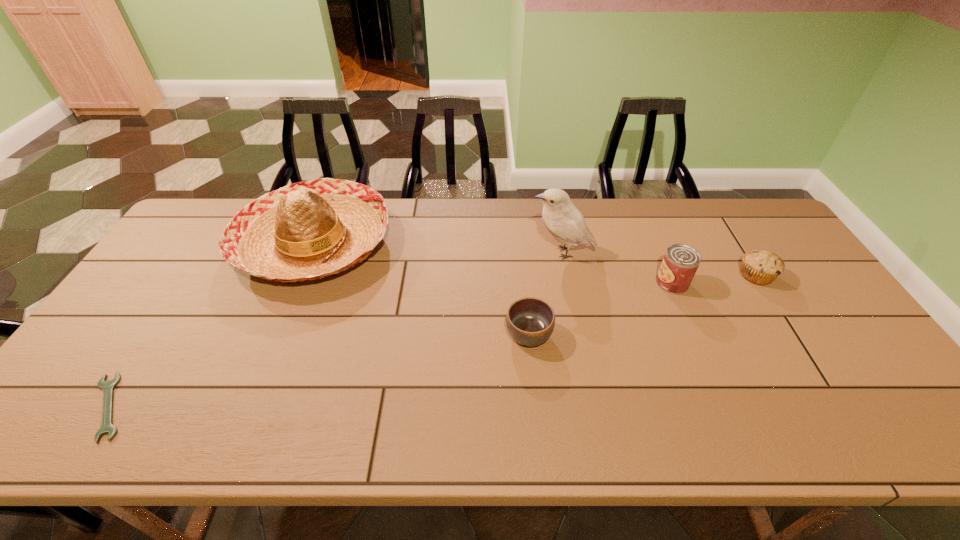
Find the location of `vacant area that lies between the fifth object from left to right and the rightmost object`. vacant area that lies between the fifth object from left to right and the rightmost object is located at coordinates (714, 279).

I want to click on vacant space in between the second nearest object and the muffin, so click(x=642, y=305).

Find the location of a particular element. The width and height of the screenshot is (960, 540). vacant area between the fifth farthest object and the rightmost object is located at coordinates (642, 305).

Locate an element on the screen. free area in between the second tallest object and the leftmost object is located at coordinates (211, 325).

Identify the location of free point between the second nearest object and the second object from left to right. This screenshot has width=960, height=540. (421, 289).

This screenshot has width=960, height=540. In order to click on vacant space that's between the can and the shortest object in this screenshot , I will do (391, 345).

Find the location of a particular element. This screenshot has width=960, height=540. free space between the tallest object and the second object from right to left is located at coordinates [617, 268].

Locate an element on the screen. The image size is (960, 540). the fifth closest object to the bird is located at coordinates (107, 427).

Identify which object is located as the fifth nearest to the shortest object. Please provide its 2D coordinates. Your answer should be formatted as a tuple, i.e. [(x, y)], where the tuple contains the x and y coordinates of a point satisfying the conditions above.

[(762, 267)]

This screenshot has width=960, height=540. Find the location of `free space that satisfies the following two spatial constraints: 1. at the beak of the tallest object; 2. on the right side of the rightmost object`. free space that satisfies the following two spatial constraints: 1. at the beak of the tallest object; 2. on the right side of the rightmost object is located at coordinates tap(566, 275).